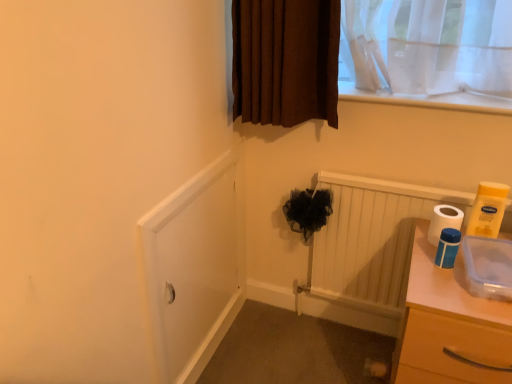
This screenshot has width=512, height=384. Describe the element at coordinates (488, 210) in the screenshot. I see `white glossy toilet paper at right, which is counted as the 3th toilet paper, starting from the left` at that location.

How much space does white glossy toilet paper at right, which is counted as the 3th toilet paper, starting from the left, occupy vertically?

8.66 inches.

Image resolution: width=512 pixels, height=384 pixels. Describe the element at coordinates (448, 325) in the screenshot. I see `clear plastic chest of drawers at right` at that location.

I want to click on white glossy toilet paper at right, which is counted as the 3th toilet paper, starting from the left, so click(x=488, y=210).

Which is behind, point (393, 377) or point (446, 259)?

The point (393, 377) is farther.

From the image's perspective, is clear plastic chest of drawers at right beneath blue plastic toilet paper at right, which is the third toilet paper from right to left?

Correct, clear plastic chest of drawers at right appears lower than blue plastic toilet paper at right, which is the third toilet paper from right to left, in the image.

Could you tell me if clear plastic chest of drawers at right is turned towards blue plastic toilet paper at right, which is the third toilet paper from right to left?

No, clear plastic chest of drawers at right does not turn towards blue plastic toilet paper at right, which is the third toilet paper from right to left.

Looking at their sizes, would you say clear plastic chest of drawers at right is wider or thinner than blue plastic toilet paper at right, marked as the first toilet paper in a left-to-right arrangement?

In the image, clear plastic chest of drawers at right appears to be wider than blue plastic toilet paper at right, marked as the first toilet paper in a left-to-right arrangement.

Is white matte screen door at lower left facing towards blue plastic toilet paper at right, which is the third toilet paper from right to left?

Yes, white matte screen door at lower left is turned towards blue plastic toilet paper at right, which is the third toilet paper from right to left.

From the image's perspective, does white matte screen door at lower left appear lower than blue plastic toilet paper at right, which is the third toilet paper from right to left?

Yes, from the image's perspective, white matte screen door at lower left is below blue plastic toilet paper at right, which is the third toilet paper from right to left.

Considering the relative sizes of white matte screen door at lower left and blue plastic toilet paper at right, which is the third toilet paper from right to left, in the image provided, is white matte screen door at lower left bigger than blue plastic toilet paper at right, which is the third toilet paper from right to left,?

Yes.

Consider the image. Which of these two, clear plastic chest of drawers at right or white matte screen door at lower left, stands taller?

white matte screen door at lower left.

From the image's perspective, which one is positioned lower, clear plastic chest of drawers at right or white matte screen door at lower left?

From the image's view, clear plastic chest of drawers at right is below.

Can you tell me how much clear plastic chest of drawers at right and white matte screen door at lower left differ in facing direction?

clear plastic chest of drawers at right and white matte screen door at lower left are facing 91.3 degrees away from each other.

Does clear plastic chest of drawers at right have a larger size compared to white matte screen door at lower left?

Yes, clear plastic chest of drawers at right is bigger than white matte screen door at lower left.

Is point (444, 254) closer or farther from the camera than point (495, 184)?

Point (444, 254) appears to be closer to the viewer than point (495, 184).

Does blue plastic toilet paper at right, which is the third toilet paper from right to left, have a lesser width compared to white glossy toilet paper at right, the first toilet paper when ordered from right to left?

Indeed, blue plastic toilet paper at right, which is the third toilet paper from right to left, has a lesser width compared to white glossy toilet paper at right, the first toilet paper when ordered from right to left.

Based on the photo, considering the positions of objects blue plastic toilet paper at right, which is the third toilet paper from right to left, and white glossy toilet paper at right, the first toilet paper when ordered from right to left, in the image provided, who is behind, blue plastic toilet paper at right, which is the third toilet paper from right to left, or white glossy toilet paper at right, the first toilet paper when ordered from right to left,?

white glossy toilet paper at right, the first toilet paper when ordered from right to left, is further away from the camera.

Would you consider white matte screen door at lower left to be distant from clear plastic chest of drawers at right?

white matte screen door at lower left is actually quite close to clear plastic chest of drawers at right.

What's the angular difference between white matte screen door at lower left and clear plastic chest of drawers at right's facing directions?

They differ by 91.3 degrees in their facing directions.

Is white matte screen door at lower left at the right side of clear plastic chest of drawers at right?

In fact, white matte screen door at lower left is to the left of clear plastic chest of drawers at right.

Considering the sizes of objects white matte screen door at lower left and clear plastic chest of drawers at right in the image provided, who is bigger, white matte screen door at lower left or clear plastic chest of drawers at right?

clear plastic chest of drawers at right.

From the image's perspective, between blue plastic toilet paper at right, marked as the first toilet paper in a left-to-right arrangement, and white matte toilet paper at right, placed as the second toilet paper when sorted from left to right, which one is located above?

From the image's view, white matte toilet paper at right, placed as the second toilet paper when sorted from left to right, is above.

From a real-world perspective, which is physically below, blue plastic toilet paper at right, which is the third toilet paper from right to left, or white matte toilet paper at right, which ranks as the second toilet paper in right-to-left order?

white matte toilet paper at right, which ranks as the second toilet paper in right-to-left order, is physically lower.

Would you say blue plastic toilet paper at right, marked as the first toilet paper in a left-to-right arrangement, is to the left or to the right of white matte toilet paper at right, which ranks as the second toilet paper in right-to-left order, in the picture?

In the image, blue plastic toilet paper at right, marked as the first toilet paper in a left-to-right arrangement, appears on the left side of white matte toilet paper at right, which ranks as the second toilet paper in right-to-left order.

From the picture: Is white matte screen door at lower left directly adjacent to white wooden radiator at lower center?

No, white matte screen door at lower left is not touching white wooden radiator at lower center.

Consider the image. How many degrees apart are the facing directions of white matte screen door at lower left and white wooden radiator at lower center?

There is a 89.9-degree angle between the facing directions of white matte screen door at lower left and white wooden radiator at lower center.

Which is correct: white matte screen door at lower left is inside white wooden radiator at lower center, or outside of it?

white matte screen door at lower left is located beyond the bounds of white wooden radiator at lower center.

Between point (169, 250) and point (445, 190), which one is positioned behind?

The point (445, 190) is behind.

Identify the location of the chest of drawers that is under the blue plastic toilet paper at right, marked as the first toilet paper in a left-to-right arrangement (from a real-world perspective). The image size is (512, 384). (448, 325).

In order to click on screen door behind the blue plastic toilet paper at right, which is the third toilet paper from right to left in this screenshot , I will do `click(193, 269)`.

When comparing their distances from white matte toilet paper at right, placed as the second toilet paper when sorted from left to right, does white wooden radiator at lower center or blue plastic toilet paper at right, which is the third toilet paper from right to left, seem closer?

The object closer to white matte toilet paper at right, placed as the second toilet paper when sorted from left to right, is blue plastic toilet paper at right, which is the third toilet paper from right to left.

Which object lies nearer to the anchor point white wooden radiator at lower center, white glossy toilet paper at right, which is counted as the 3th toilet paper, starting from the left, or blue plastic toilet paper at right, marked as the first toilet paper in a left-to-right arrangement?

The object closer to white wooden radiator at lower center is white glossy toilet paper at right, which is counted as the 3th toilet paper, starting from the left.

Looking at the image, which one is located closer to white wooden radiator at lower center, white glossy toilet paper at right, the first toilet paper when ordered from right to left, or white matte toilet paper at right, placed as the second toilet paper when sorted from left to right?

white matte toilet paper at right, placed as the second toilet paper when sorted from left to right, is closer to white wooden radiator at lower center.

Which object lies nearer to the anchor point white glossy toilet paper at right, which is counted as the 3th toilet paper, starting from the left, white matte toilet paper at right, placed as the second toilet paper when sorted from left to right, or blue plastic toilet paper at right, which is the third toilet paper from right to left?

Among the two, white matte toilet paper at right, placed as the second toilet paper when sorted from left to right, is located nearer to white glossy toilet paper at right, which is counted as the 3th toilet paper, starting from the left.

Which object lies nearer to the anchor point white matte screen door at lower left, white wooden radiator at lower center or white glossy toilet paper at right, which is counted as the 3th toilet paper, starting from the left?

Among the two, white wooden radiator at lower center is located nearer to white matte screen door at lower left.

Which object lies further to the anchor point white wooden radiator at lower center, clear plastic chest of drawers at right or white matte screen door at lower left?

Based on the image, white matte screen door at lower left appears to be further to white wooden radiator at lower center.

When comparing their distances from clear plastic chest of drawers at right, does white wooden radiator at lower center or white glossy toilet paper at right, which is counted as the 3th toilet paper, starting from the left, seem further?

Based on the image, white wooden radiator at lower center appears to be further to clear plastic chest of drawers at right.

Which object lies nearer to the anchor point blue plastic toilet paper at right, which is the third toilet paper from right to left, white glossy toilet paper at right, which is counted as the 3th toilet paper, starting from the left, or white matte screen door at lower left?

Based on the image, white glossy toilet paper at right, which is counted as the 3th toilet paper, starting from the left, appears to be nearer to blue plastic toilet paper at right, which is the third toilet paper from right to left.

Where is `radiator situated between white matte screen door at lower left and white matte toilet paper at right, which ranks as the second toilet paper in right-to-left order, from left to right`? The width and height of the screenshot is (512, 384). radiator situated between white matte screen door at lower left and white matte toilet paper at right, which ranks as the second toilet paper in right-to-left order, from left to right is located at coordinates (371, 239).

You are a GUI agent. You are given a task and a screenshot of the screen. Output one action in this format:
    pyautogui.click(x=<x>, y=<y>)
    Task: Click on the toilet paper between white matte toilet paper at right, placed as the second toilet paper when sorted from left to right, and clear plastic chest of drawers at right in the up-down direction
    The width and height of the screenshot is (512, 384).
    Given the screenshot: What is the action you would take?
    pyautogui.click(x=447, y=248)

The image size is (512, 384). In order to click on radiator between white matte screen door at lower left and clear plastic chest of drawers at right in this screenshot , I will do `click(371, 239)`.

This screenshot has height=384, width=512. Find the location of `toilet paper located between blue plastic toilet paper at right, which is the third toilet paper from right to left, and white glossy toilet paper at right, the first toilet paper when ordered from right to left, in the left-right direction`. toilet paper located between blue plastic toilet paper at right, which is the third toilet paper from right to left, and white glossy toilet paper at right, the first toilet paper when ordered from right to left, in the left-right direction is located at coordinates (443, 221).